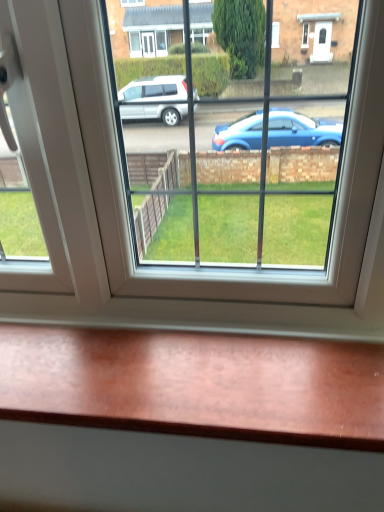
The width and height of the screenshot is (384, 512). Find the location of `wooden table at bottom`. wooden table at bottom is located at coordinates [x=196, y=384].

Describe the element at coordinates (196, 384) in the screenshot. I see `wooden table at bottom` at that location.

Find the location of a particular element. The image size is (384, 512). wooden table at bottom is located at coordinates (196, 384).